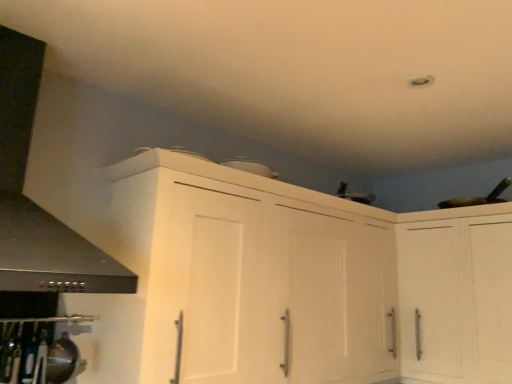
Question: From the image's perspective, is white matte cabinet at upper right, which ranks as the second cabinetry in left-to-right order, over black matte exhaust hood at left?

Choices:
 (A) yes
 (B) no

Answer: (B)

Question: Can you confirm if white matte cabinet at upper right, the 1th cabinetry positioned from the right, is wider than black matte exhaust hood at left?

Choices:
 (A) no
 (B) yes

Answer: (A)

Question: Is white matte cabinet at upper right, the 1th cabinetry positioned from the right, at the right side of black matte exhaust hood at left?

Choices:
 (A) yes
 (B) no

Answer: (A)

Question: Is white matte cabinet at upper right, the 1th cabinetry positioned from the right, completely or partially outside of black matte exhaust hood at left?

Choices:
 (A) no
 (B) yes

Answer: (B)

Question: Can you see white matte cabinet at upper right, which ranks as the second cabinetry in left-to-right order, touching black matte exhaust hood at left?

Choices:
 (A) no
 (B) yes

Answer: (A)

Question: Does white matte cabinet at upper right, which ranks as the second cabinetry in left-to-right order, come behind black matte exhaust hood at left?

Choices:
 (A) no
 (B) yes

Answer: (B)

Question: Does black matte exhaust hood at left touch white matte cabinet at upper right, which ranks as the second cabinetry in left-to-right order?

Choices:
 (A) yes
 (B) no

Answer: (B)

Question: Considering the relative positions of black matte exhaust hood at left and white matte cabinet at upper right, which ranks as the second cabinetry in left-to-right order, in the image provided, is black matte exhaust hood at left to the left of white matte cabinet at upper right, which ranks as the second cabinetry in left-to-right order, from the viewer's perspective?

Choices:
 (A) yes
 (B) no

Answer: (A)

Question: Can you confirm if black matte exhaust hood at left is taller than white matte cabinet at upper right, which ranks as the second cabinetry in left-to-right order?

Choices:
 (A) yes
 (B) no

Answer: (B)

Question: Considering the relative sizes of black matte exhaust hood at left and white matte cabinet at upper right, the 1th cabinetry positioned from the right, in the image provided, is black matte exhaust hood at left smaller than white matte cabinet at upper right, the 1th cabinetry positioned from the right,?

Choices:
 (A) yes
 (B) no

Answer: (A)

Question: Does black matte exhaust hood at left have a lesser width compared to white matte cabinet at upper right, the 1th cabinetry positioned from the right?

Choices:
 (A) no
 (B) yes

Answer: (A)

Question: Considering the relative positions of black matte exhaust hood at left and white matte cabinet at upper right, which ranks as the second cabinetry in left-to-right order, in the image provided, is black matte exhaust hood at left to the right of white matte cabinet at upper right, which ranks as the second cabinetry in left-to-right order, from the viewer's perspective?

Choices:
 (A) yes
 (B) no

Answer: (B)

Question: From a real-world perspective, is white matte cabinet at upper right, the 1th cabinetry positioned from the right, below white matte cabinet at upper center, the first cabinetry in the left-to-right sequence?

Choices:
 (A) no
 (B) yes

Answer: (B)